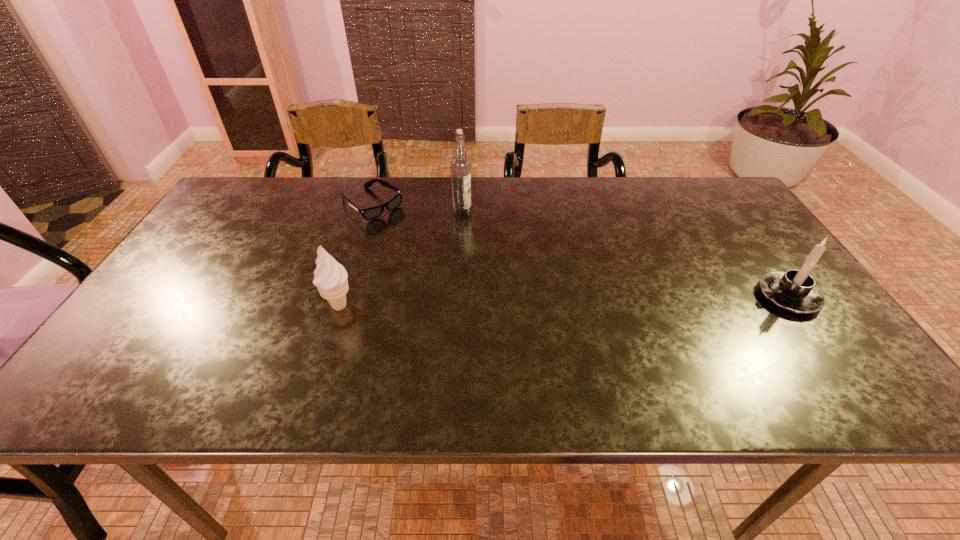
The width and height of the screenshot is (960, 540). In order to click on free space located on the front-facing side of the sunglasses in this screenshot , I will do `click(468, 275)`.

This screenshot has height=540, width=960. Identify the location of vacant space located on the front-facing side of the sunglasses. (468, 275).

You are a GUI agent. You are given a task and a screenshot of the screen. Output one action in this format:
    pyautogui.click(x=<x>, y=<y>)
    Task: Click on the blank space located on the label of the tallest object
    
    Given the screenshot: What is the action you would take?
    pyautogui.click(x=553, y=292)

Identify the location of free space located on the label of the tallest object. (497, 244).

Where is `vacant space positioned on the label of the tallest object`? Image resolution: width=960 pixels, height=540 pixels. vacant space positioned on the label of the tallest object is located at coordinates (522, 265).

Where is `sunglasses that is at the far edge`? sunglasses that is at the far edge is located at coordinates (371, 213).

Image resolution: width=960 pixels, height=540 pixels. Identify the location of vodka at the far edge. (460, 166).

Find the location of `object that is at the right edge`. object that is at the right edge is located at coordinates (795, 291).

Locate an element on the screen. vacant space at the far edge of the desktop is located at coordinates (294, 218).

At what (x,y) coordinates should I click in order to perform the action: click on vacant space at the near edge of the desktop. Please return your answer as a coordinate pair (x, y). This screenshot has width=960, height=540. Looking at the image, I should click on (495, 342).